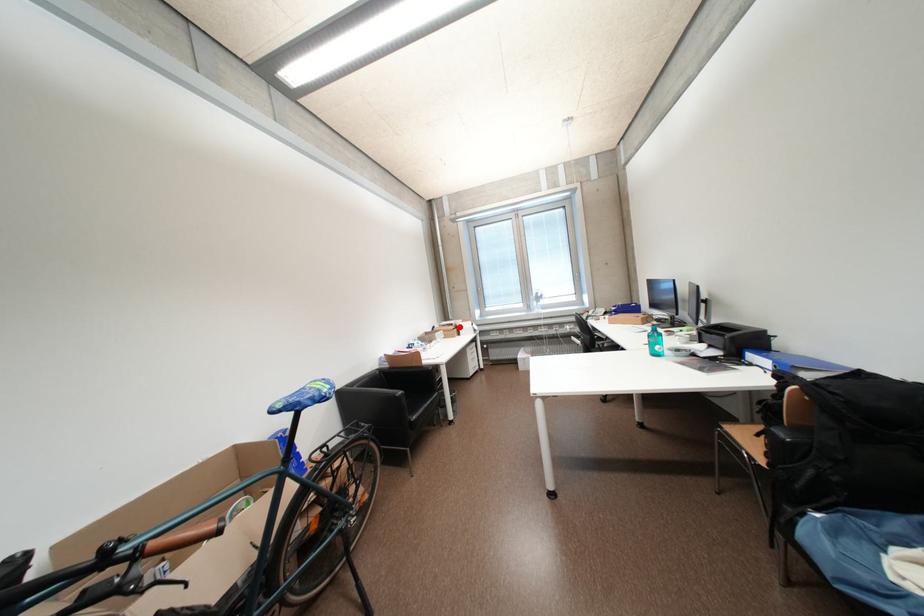
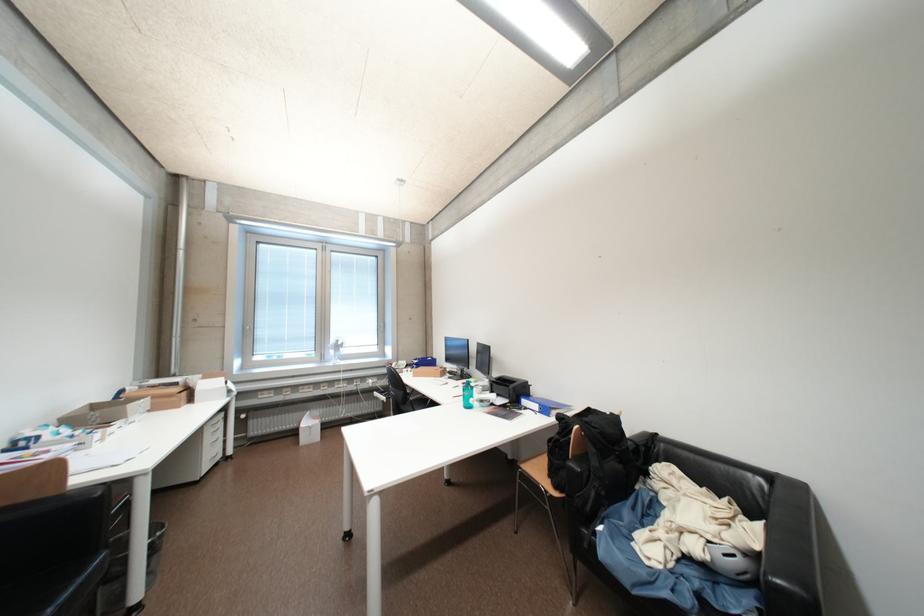
In the second image, find the point that corresponds to the highlighted location in the first image.

(184, 386)